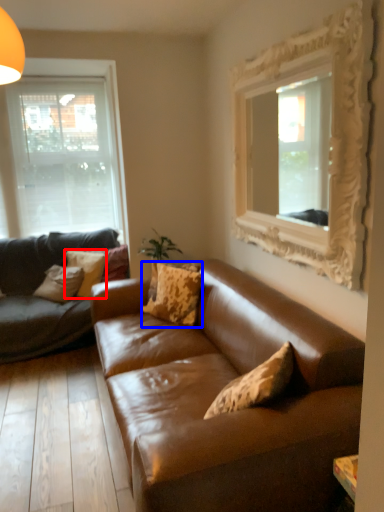
Question: Which object appears farthest to the camera in this image, pillow (highlighted by a red box) or pillow (highlighted by a blue box)?

Choices:
 (A) pillow
 (B) pillow

Answer: (A)